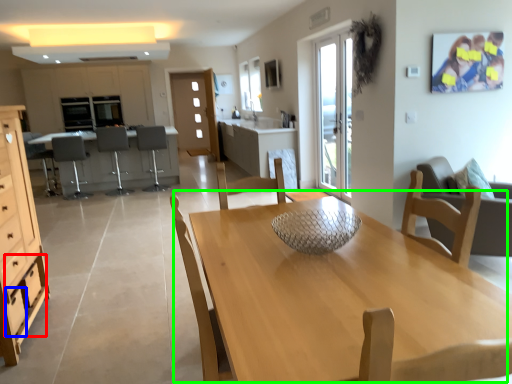
Question: Considering the real-world distances, which object is farthest from drawer (highlighted by a red box)? drawer (highlighted by a blue box) or kitchen & dining room table (highlighted by a green box)?

Choices:
 (A) drawer
 (B) kitchen & dining room table

Answer: (B)